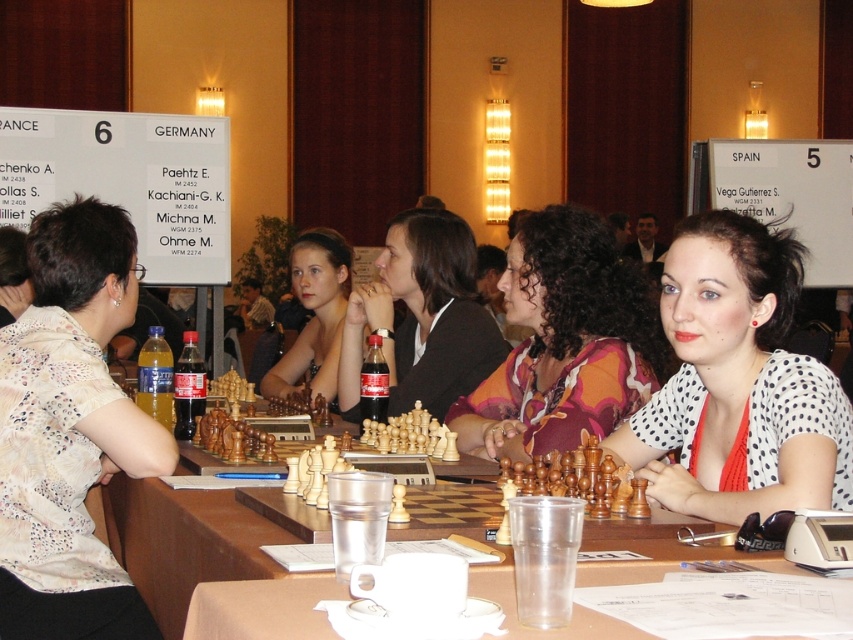
You are organizing a chess tournament and need to ensure there is enough space on the table for all participants. Given the items on the table, which object takes up more space between the matte black jacket at center and the matte black chess pieces at center?

The matte black chess pieces at center take up more space than the matte black jacket at center.

From the picture: You are a photographer trying to capture a clear shot of the matte black chess pieces at center without any obstructions. Given that the printed fabric shirt at center is covering part of them, can you adjust your angle to avoid the shirt?

The printed fabric shirt at center is positioned over the matte black chess pieces at center, so adjusting the angle to look underneath the shirt might allow you to capture the chess pieces without obstruction.

You are a photographer taking a picture of the scene. You want to ensure both the printed fabric shirt at center and the matte black chess pieces at center are in focus. Which object should you adjust your camera focus to prioritize to ensure both are sharp?

Since the printed fabric shirt at center is closer to the viewer than the matte black chess pieces at center, you should focus on the printed fabric shirt at center. This will ensure the matte black chess pieces at center, which are farther away, remain in focus due to the depth of field extending backward.